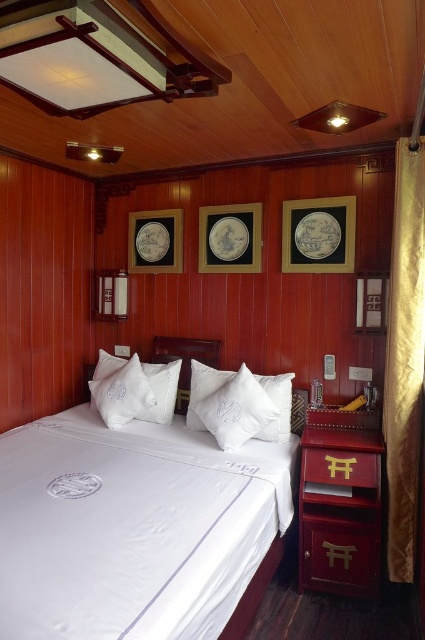
In the scene shown: You are designing a layout for a furniture catalog and need to ensure that the white satin bed at center and the matte black picture frame at center are displayed proportionally. Based on the scene, which object should be depicted as taller in the catalog?

The white satin bed at center should be depicted as taller since it is taller than the matte black picture frame at center according to the scene description.

You are standing in the cabin and want to hang a new picture frame on the wall. The current matte black picture frame at upper right is already there. Where should you place the new frame so it doesn not block the view of the white satin bed at center?

The white satin bed at center is in front of the matte black picture frame at upper right, so placing the new frame behind the bed would prevent it from blocking the view of the bed.

Looking at this image, you are standing in the cabin and want to hang a new painting that requires a minimum of 1.5 meters in height. You see the gold textured curtain at right and the matte black picture frame at upper right. Which object provides enough vertical space for the painting?

The gold textured curtain at right has a greater height compared to the matte black picture frame at upper right, so it can accommodate the painting requiring 1.5 meters in height.